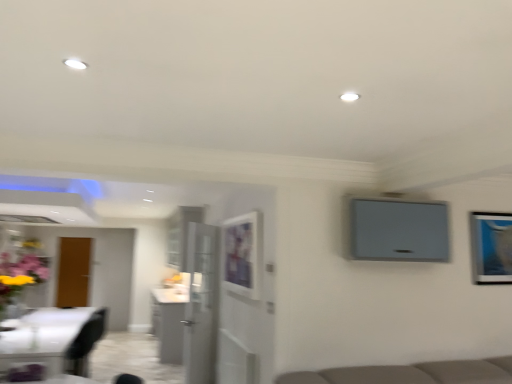
Question: From a real-world perspective, is white glossy cabinet at center physically located above or below matte white picture frame at center, acting as the first picture frame starting from the left?

Choices:
 (A) below
 (B) above

Answer: (A)

Question: Is white glossy cabinet at center inside or outside of matte white picture frame at center, acting as the first picture frame starting from the left?

Choices:
 (A) inside
 (B) outside

Answer: (B)

Question: Considering the real-world distances, which object is farthest from the matte purple vase at left?

Choices:
 (A) matte white picture frame at center, acting as the first picture frame starting from the left
 (B) metallic silver picture frame at upper right, which ranks as the 2th picture frame in left-to-right order
 (C) white glossy cabinet at center
 (D) transparent glass door at center

Answer: (B)

Question: Which object is positioned closest to the metallic silver picture frame at upper right, which ranks as the 2th picture frame in left-to-right order?

Choices:
 (A) white glossy cabinet at center
 (B) matte white picture frame at center, the second picture frame from the right
 (C) transparent glass door at center
 (D) matte purple vase at left

Answer: (B)